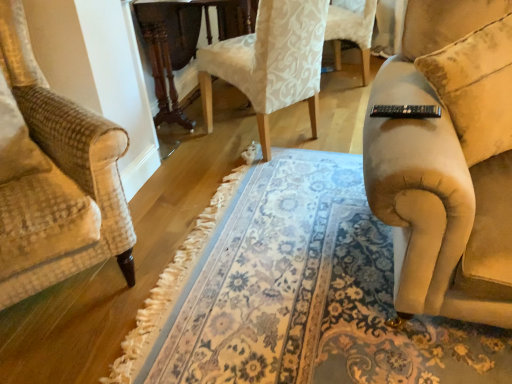
Question: Does floral carpet at center lie behind beige fabric couch at right?

Choices:
 (A) yes
 (B) no

Answer: (B)

Question: Can you confirm if floral carpet at center is positioned to the right of beige fabric couch at right?

Choices:
 (A) yes
 (B) no

Answer: (B)

Question: Is floral carpet at center looking in the opposite direction of beige fabric couch at right?

Choices:
 (A) no
 (B) yes

Answer: (A)

Question: Is floral carpet at center placed right next to beige fabric couch at right?

Choices:
 (A) yes
 (B) no

Answer: (B)

Question: Is there a large distance between floral carpet at center and beige fabric couch at right?

Choices:
 (A) yes
 (B) no

Answer: (B)

Question: From a real-world perspective, is floral carpet at center above or below beige fabric couch at right?

Choices:
 (A) above
 (B) below

Answer: (B)

Question: Based on their sizes in the image, would you say floral carpet at center is bigger or smaller than beige fabric couch at right?

Choices:
 (A) big
 (B) small

Answer: (A)

Question: From the image's perspective, relative to beige fabric couch at right, is floral carpet at center above or below?

Choices:
 (A) below
 (B) above

Answer: (A)

Question: Looking at their shapes, would you say floral carpet at center is wider or thinner than beige fabric couch at right?

Choices:
 (A) thin
 (B) wide

Answer: (B)

Question: Is beige fabric couch at right to the left or to the right of white damask fabric chair at center in the image?

Choices:
 (A) right
 (B) left

Answer: (A)

Question: Relative to white damask fabric chair at center, is beige fabric couch at right in front or behind?

Choices:
 (A) behind
 (B) front

Answer: (B)

Question: Which is correct: beige fabric couch at right is inside white damask fabric chair at center, or outside of it?

Choices:
 (A) inside
 (B) outside

Answer: (B)

Question: Is point (510, 104) positioned closer to the camera than point (314, 44)?

Choices:
 (A) closer
 (B) farther

Answer: (A)

Question: In terms of height, does dark wood round table at center look taller or shorter compared to floral carpet at center?

Choices:
 (A) tall
 (B) short

Answer: (A)

Question: From the image's perspective, is dark wood round table at center located above or below floral carpet at center?

Choices:
 (A) below
 (B) above

Answer: (B)